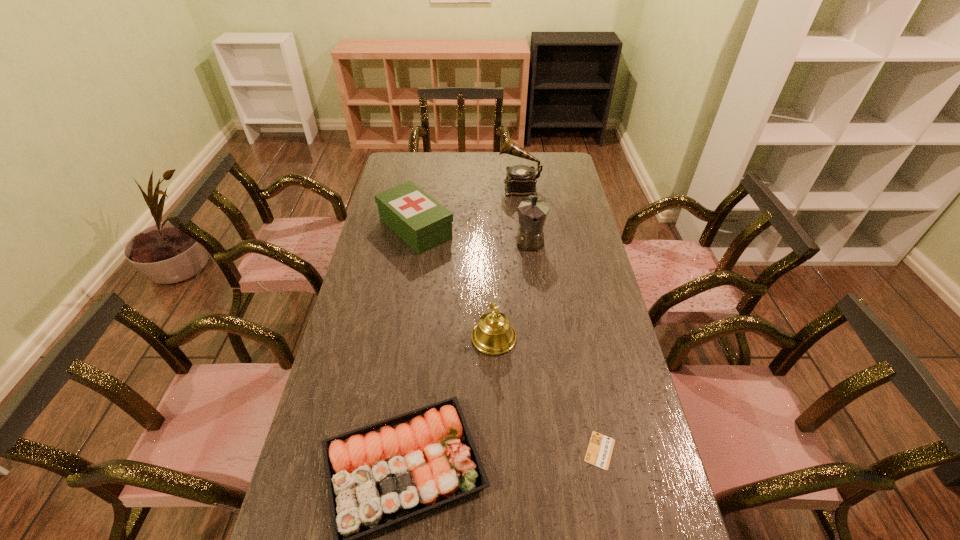
You are a GUI agent. You are given a task and a screenshot of the screen. Output one action in this format:
    pyautogui.click(x=<x>, y=<y>)
    Task: Click on the free space between the fourth farthest object and the coffeepot
    The height and width of the screenshot is (540, 960).
    Given the screenshot: What is the action you would take?
    pyautogui.click(x=512, y=289)

Where is `unoccupied position between the first-aid kit and the farthest object`? unoccupied position between the first-aid kit and the farthest object is located at coordinates (468, 208).

Where is `empty space between the fourth tallest object and the farthest object`? empty space between the fourth tallest object and the farthest object is located at coordinates (468, 208).

Locate an element on the screen. vacant space in between the first-aid kit and the coffeepot is located at coordinates (472, 234).

Identify which object is the third closest to the farthest object. Please provide its 2D coordinates. Your answer should be formatted as a tuple, i.e. [(x, y)], where the tuple contains the x and y coordinates of a point satisfying the conditions above.

[(494, 335)]

Locate which object is the closest to the fourth farthest object. Please provide its 2D coordinates. Your answer should be formatted as a tuple, i.e. [(x, y)], where the tuple contains the x and y coordinates of a point satisfying the conditions above.

[(379, 475)]

Locate an element on the screen. free point that satisfies the following two spatial constraints: 1. on the front side of the third shortest object; 2. on the left side of the fourth shortest object is located at coordinates (396, 338).

You are a GUI agent. You are given a task and a screenshot of the screen. Output one action in this format:
    pyautogui.click(x=<x>, y=<y>)
    Task: Click on the vacant space that satisfies the following two spatial constraints: 1. on the pouring side of the coffeepot; 2. on the left side of the shortest object
    Image resolution: width=960 pixels, height=540 pixels.
    Given the screenshot: What is the action you would take?
    pyautogui.click(x=557, y=450)